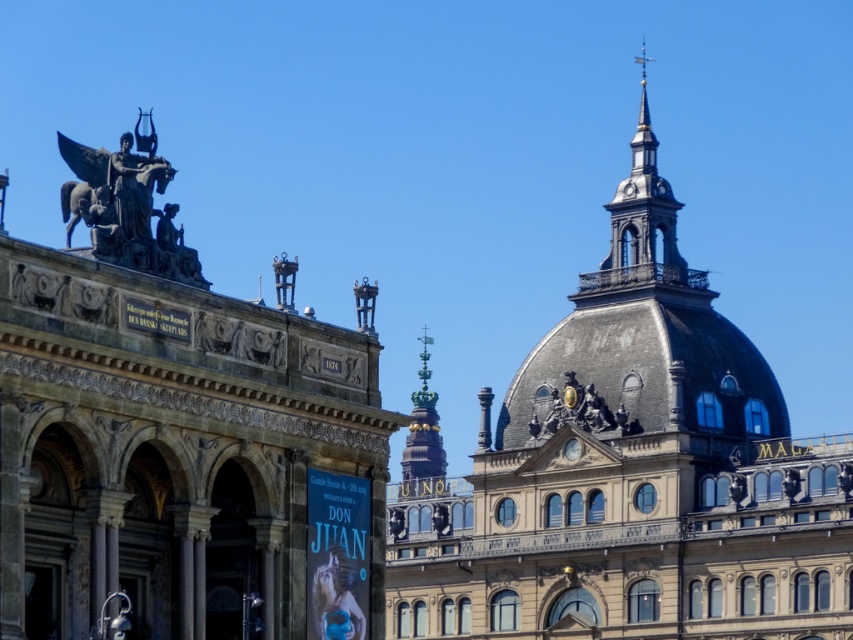
Question: Is smooth gray dome at upper center wider than bronze/statue at upper left?

Choices:
 (A) no
 (B) yes

Answer: (B)

Question: Does smooth gray dome at upper center have a lesser width compared to bronze statue at upper center?

Choices:
 (A) no
 (B) yes

Answer: (A)

Question: Which object appears farthest from the camera in this image?

Choices:
 (A) smooth gray dome at upper center
 (B) bronze statue at upper center
 (C) bronze/statue at upper left

Answer: (B)

Question: Which object appears farthest from the camera in this image?

Choices:
 (A) smooth gray dome at upper center
 (B) bronze statue at upper center

Answer: (B)

Question: Does smooth gray dome at upper center appear over bronze statue at upper center?

Choices:
 (A) no
 (B) yes

Answer: (B)

Question: Which point is closer to the camera?

Choices:
 (A) (165, 236)
 (B) (567, 400)
 (C) (521, 467)

Answer: (A)